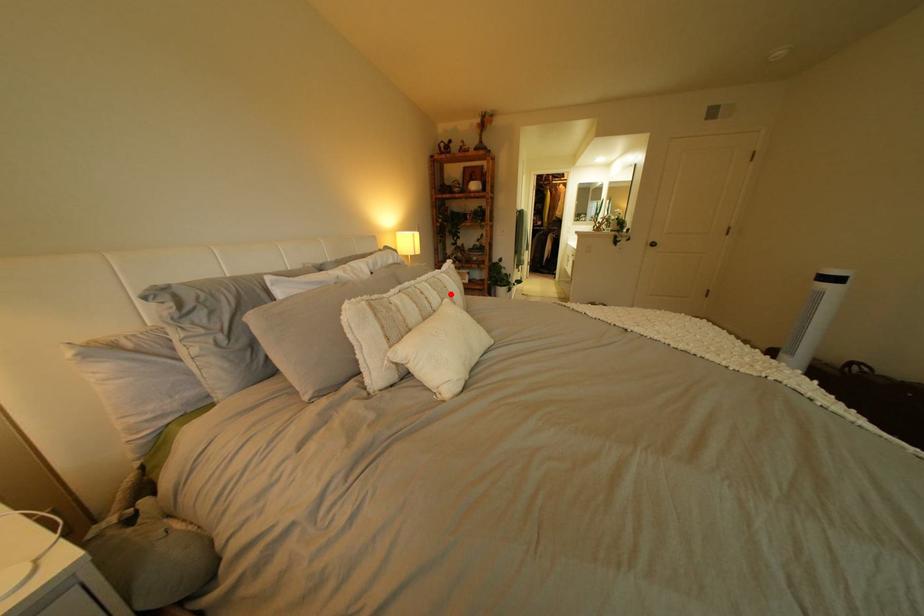
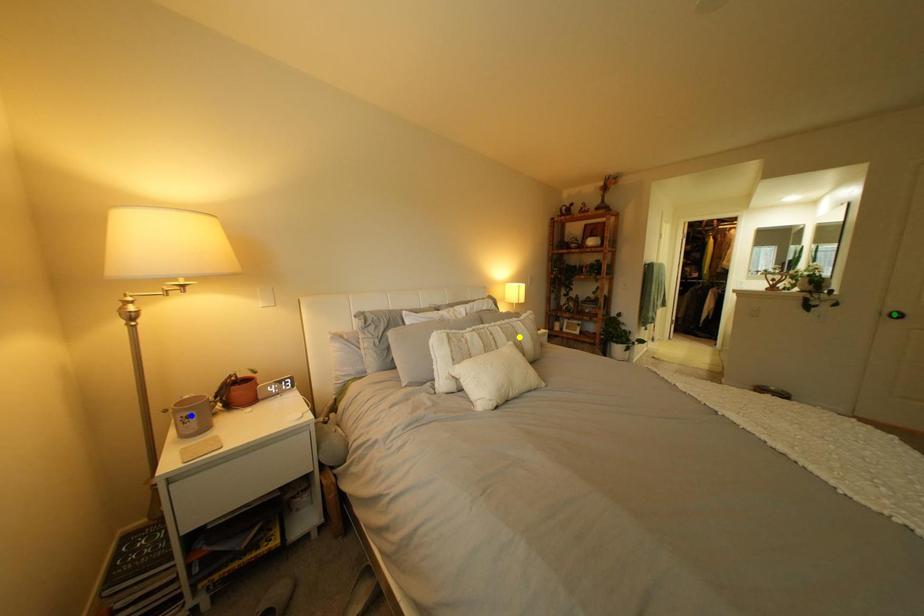
Question: I am providing you with two images of the same scene from different viewpoints. A red point is marked on the first image. You are given multiple points on the second image. Can you choose the point in image 2 that corresponds to the point in image 1?

Choices:
 (A) green point
 (B) yellow point
 (C) blue point

Answer: (B)